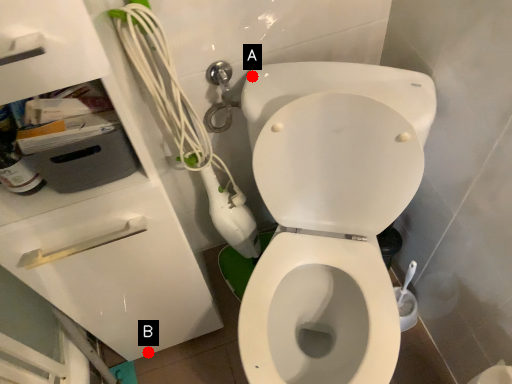
Question: Two points are circled on the image, labeled by A and B beside each circle. Among these points, which one is farthest from the camera?

Choices:
 (A) A is further
 (B) B is further

Answer: (B)